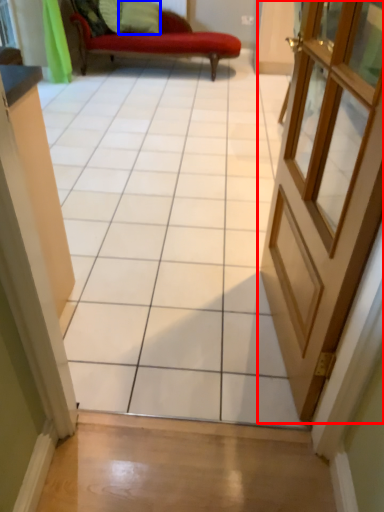
Question: Which object is closer to the camera taking this photo, door (highlighted by a red box) or pillow (highlighted by a blue box)?

Choices:
 (A) door
 (B) pillow

Answer: (A)